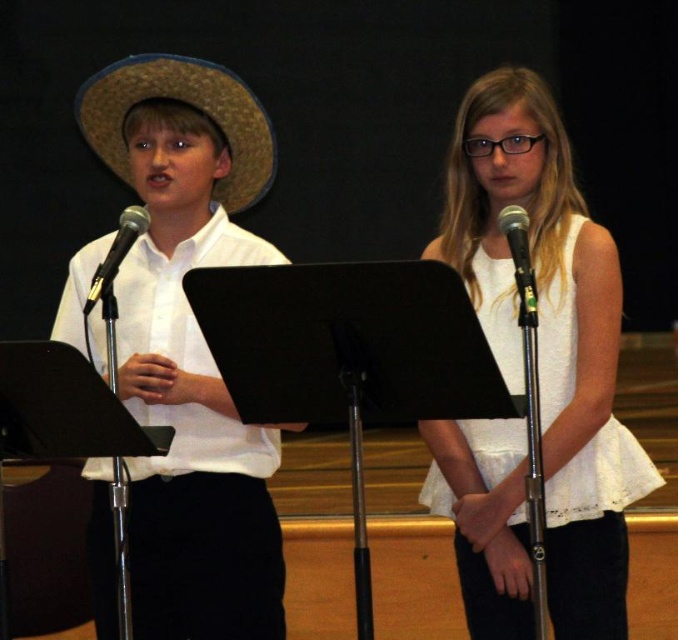
The image size is (678, 640). Describe the element at coordinates (551, 333) in the screenshot. I see `white cotton dress at center` at that location.

Can you confirm if white cotton dress at center is thinner than black metallic microphone at right?

Incorrect, white cotton dress at center's width is not less than black metallic microphone at right's.

Is point (513, 436) farther from camera compared to point (521, 211)?

Yes.

Where is `white cotton dress at center`? Image resolution: width=678 pixels, height=640 pixels. white cotton dress at center is located at coordinates (551, 333).

Does strawhat at left come in front of black metallic microphone at left?

No, strawhat at left is further to the viewer.

Measure the distance between strawhat at left and black metallic microphone at left.

strawhat at left and black metallic microphone at left are 17.32 inches apart from each other.

Between point (75, 118) and point (111, 312), which one is positioned behind?

Point (75, 118)

You are a GUI agent. You are given a task and a screenshot of the screen. Output one action in this format:
    pyautogui.click(x=<x>, y=<y>)
    Task: Click on the strawhat at left
    
    Given the screenshot: What is the action you would take?
    pyautogui.click(x=188, y=106)

Who is lower down, strawhat at left or black metallic microphone at right?

black metallic microphone at right

Is strawhat at left to the right of black metallic microphone at right from the viewer's perspective?

In fact, strawhat at left is to the left of black metallic microphone at right.

Where is `strawhat at left`? Image resolution: width=678 pixels, height=640 pixels. strawhat at left is located at coordinates (188, 106).

At what (x,y) coordinates should I click in order to perform the action: click on strawhat at left. Please return your answer as a coordinate pair (x, y). This screenshot has width=678, height=640. Looking at the image, I should click on (188, 106).